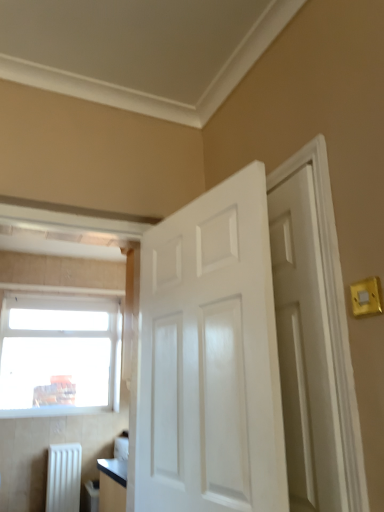
The width and height of the screenshot is (384, 512). I want to click on free spot above white matte radiator at lower left (from a real-world perspective), so click(x=62, y=445).